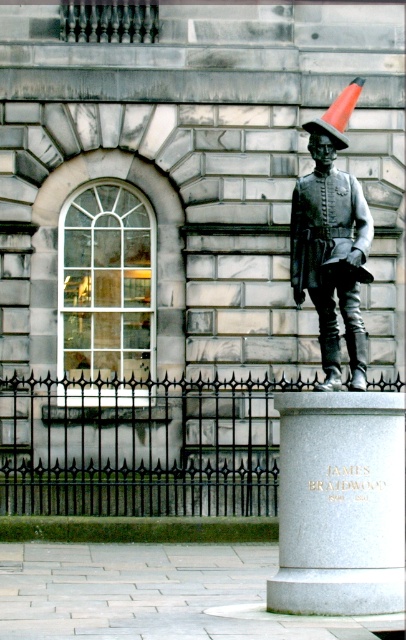
Who is positioned more to the left, polished bronze statue at right or bronze metallic uniform at center?

From the viewer's perspective, bronze metallic uniform at center appears more on the left side.

At what (x,y) coordinates should I click in order to perform the action: click on polished bronze statue at right. Please return your answer as a coordinate pair (x, y). The width and height of the screenshot is (406, 640). Looking at the image, I should click on (336, 412).